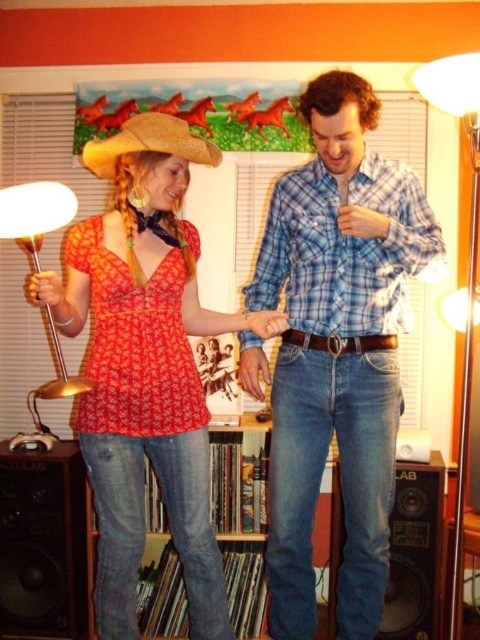
How far apart are black matte speaker at lower left and brown leather belt at center?

black matte speaker at lower left and brown leather belt at center are 4.38 feet apart.

Can you confirm if black matte speaker at lower left is taller than brown leather belt at center?

Indeed, black matte speaker at lower left has a greater height compared to brown leather belt at center.

Does point (56, 497) come behind point (327, 342)?

Yes.

At what (x,y) coordinates should I click in order to perform the action: click on black matte speaker at lower left. Please return your answer as a coordinate pair (x, y). This screenshot has height=640, width=480. Looking at the image, I should click on (43, 541).

How much distance is there between matte red blouse at center and strawhat at upper left?

matte red blouse at center and strawhat at upper left are 18.61 inches apart.

Does matte red blouse at center have a larger size compared to strawhat at upper left?

Yes.

Does point (126, 316) come farther from viewer compared to point (162, 148)?

Yes, it is behind point (162, 148).

Locate an element on the screen. This screenshot has height=640, width=480. matte red blouse at center is located at coordinates (145, 364).

Which is behind, point (283, 605) or point (289, 336)?

The point (283, 605) is behind.

Who is positioned more to the left, blue plaid shirt at center or brown leather belt at center?

blue plaid shirt at center

This screenshot has width=480, height=640. I want to click on blue plaid shirt at center, so click(x=344, y=224).